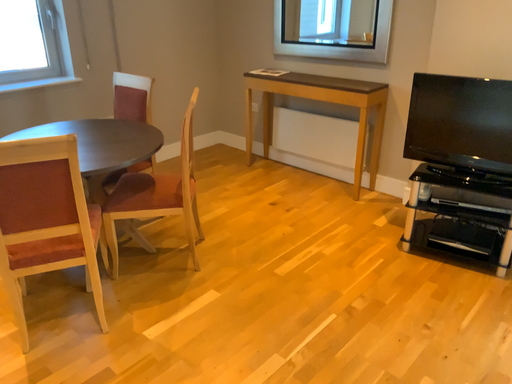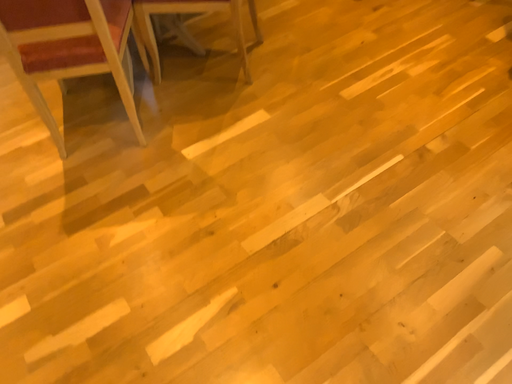
Question: Which way did the camera rotate in the video?

Choices:
 (A) rotated upward
 (B) rotated downward

Answer: (B)